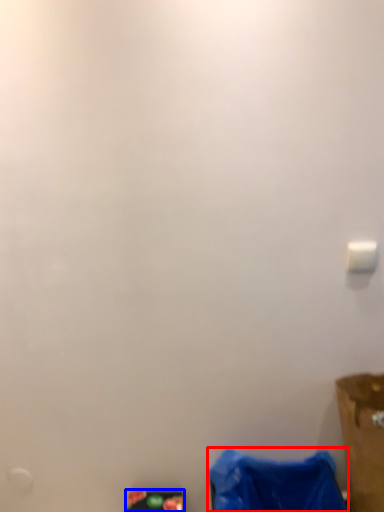
Question: Which object appears closest to the camera in this image, waste (highlighted by a red box) or waste (highlighted by a blue box)?

Choices:
 (A) waste
 (B) waste

Answer: (A)